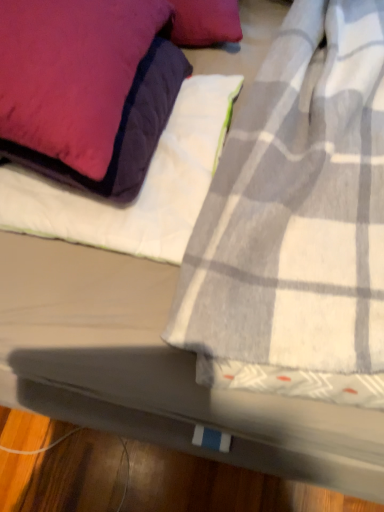
Question: Considering the positions of velvet purple pillow at upper left and white quilted sheet at upper left in the image, is velvet purple pillow at upper left wider or thinner than white quilted sheet at upper left?

Choices:
 (A) wide
 (B) thin

Answer: (A)

Question: From the image's perspective, is velvet purple pillow at upper left positioned above or below white quilted sheet at upper left?

Choices:
 (A) below
 (B) above

Answer: (B)

Question: From a real-world perspective, is velvet purple pillow at upper left positioned above or below white quilted sheet at upper left?

Choices:
 (A) above
 (B) below

Answer: (A)

Question: Which is correct: white quilted sheet at upper left is inside velvet purple pillow at upper left, or outside of it?

Choices:
 (A) outside
 (B) inside

Answer: (A)

Question: Is point (195, 113) closer or farther from the camera than point (110, 0)?

Choices:
 (A) closer
 (B) farther

Answer: (B)

Question: In the image, is white quilted sheet at upper left on the left side or the right side of velvet purple pillow at upper left?

Choices:
 (A) right
 (B) left

Answer: (A)

Question: In the image, is white quilted sheet at upper left positioned in front of or behind velvet purple pillow at upper left?

Choices:
 (A) front
 (B) behind

Answer: (B)